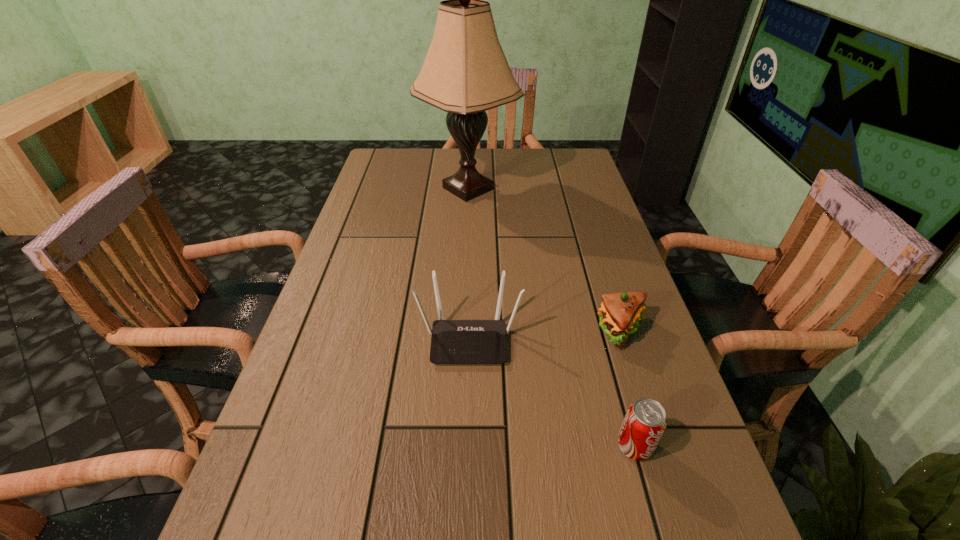
The width and height of the screenshot is (960, 540). I want to click on free spot between the tallest object and the sandwich, so click(544, 260).

Where is `vacant space that is in between the lamp and the sandwich`? This screenshot has width=960, height=540. vacant space that is in between the lamp and the sandwich is located at coordinates (544, 260).

Locate an element on the screen. free area in between the sandwich and the farthest object is located at coordinates (544, 260).

Locate an element on the screen. This screenshot has height=540, width=960. blank region between the soda and the farthest object is located at coordinates (551, 318).

Locate an element on the screen. Image resolution: width=960 pixels, height=540 pixels. vacant region between the router and the sandwich is located at coordinates click(545, 335).

Locate an element on the screen. vacant space in between the sandwich and the nearest object is located at coordinates (628, 389).

Locate which object ranks in proximity to the router. Please provide its 2D coordinates. Your answer should be formatted as a tuple, i.e. [(x, y)], where the tuple contains the x and y coordinates of a point satisfying the conditions above.

[(620, 314)]

The width and height of the screenshot is (960, 540). I want to click on object that can be found as the third closest to the sandwich, so click(465, 72).

The height and width of the screenshot is (540, 960). I want to click on free spot that satisfies the following two spatial constraints: 1. on the front side of the lamp; 2. on the left side of the soda, so click(x=458, y=446).

Where is `vacant area that satisfies the following two spatial constraints: 1. on the front-facing side of the nearest object; 2. on the left side of the router`? vacant area that satisfies the following two spatial constraints: 1. on the front-facing side of the nearest object; 2. on the left side of the router is located at coordinates (467, 446).